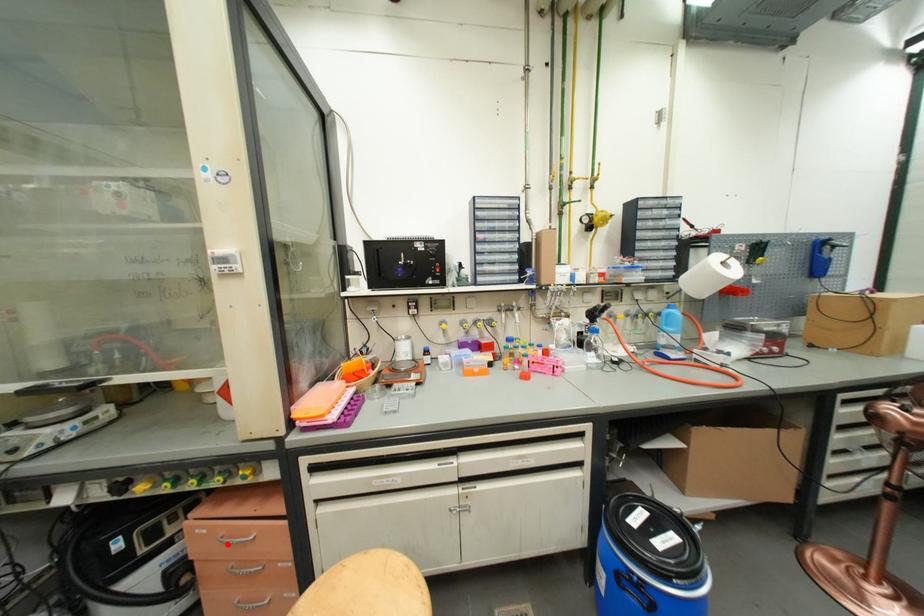
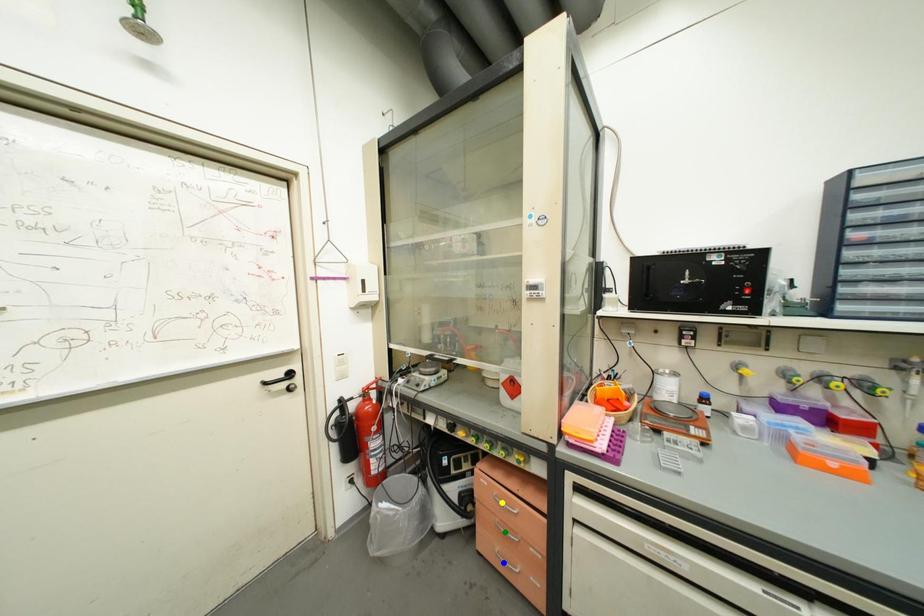
Question: I am providing you with two images of the same scene from different viewpoints. A red point is marked on the first image. You are given multiple points on the second image. Which mark in image 2 goes with the point in image 1?

Choices:
 (A) green point
 (B) yellow point
 (C) blue point

Answer: (B)